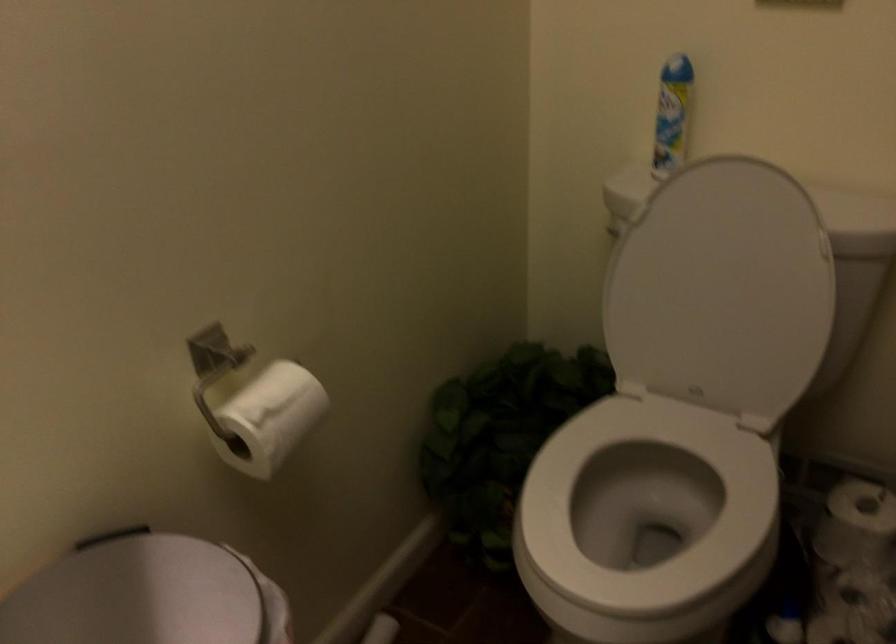
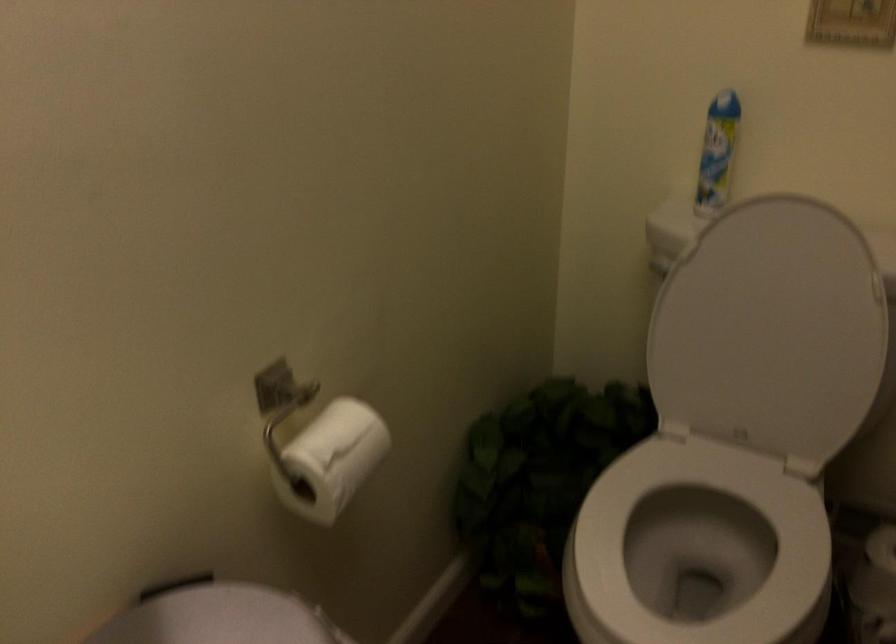
In the second image, find the point that corresponds to pixel 264 413 in the first image.

(331, 459)